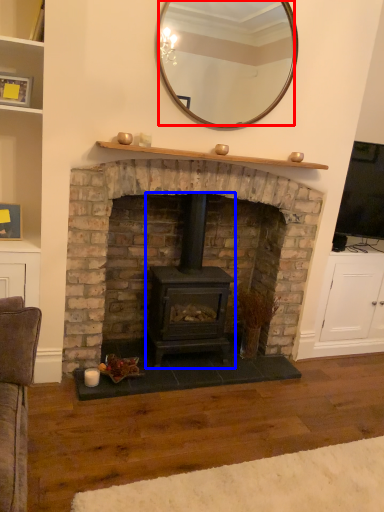
Question: Which point is further to the camera, mirror (highlighted by a red box) or wood burning stove (highlighted by a blue box)?

Choices:
 (A) mirror
 (B) wood burning stove

Answer: (B)